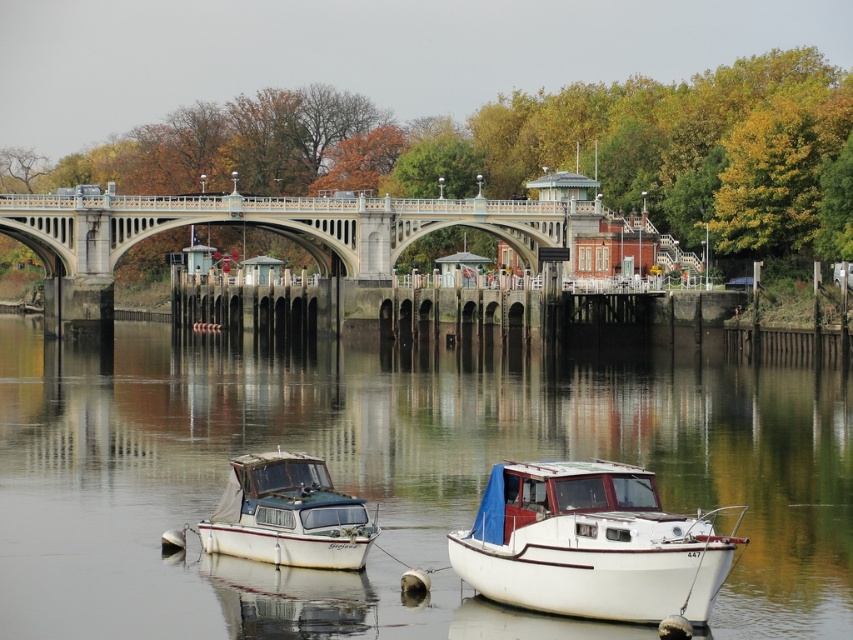
Between point (109, 483) and point (299, 524), which one is positioned behind?

Point (109, 483)

Where is `greenish water at center`? The height and width of the screenshot is (640, 853). greenish water at center is located at coordinates (392, 477).

Image resolution: width=853 pixels, height=640 pixels. In order to click on greenish water at center in this screenshot , I will do `click(392, 477)`.

Between white matte boat at lower right and white matte boat at lower left, which one appears on the right side from the viewer's perspective?

Positioned to the right is white matte boat at lower right.

Between white matte boat at lower right and white matte boat at lower left, which one appears on the left side from the viewer's perspective?

Positioned to the left is white matte boat at lower left.

Which is behind, point (614, 538) or point (213, 548)?

The point (213, 548) is behind.

Image resolution: width=853 pixels, height=640 pixels. In order to click on white matte boat at lower right in this screenshot , I will do 590,545.

Does greenish water at center have a lesser height compared to white matte boat at lower right?

In fact, greenish water at center may be taller than white matte boat at lower right.

Can you confirm if greenish water at center is wider than white matte boat at lower right?

Correct, the width of greenish water at center exceeds that of white matte boat at lower right.

Image resolution: width=853 pixels, height=640 pixels. I want to click on greenish water at center, so click(392, 477).

Locate an element on the screen. Image resolution: width=853 pixels, height=640 pixels. greenish water at center is located at coordinates (392, 477).